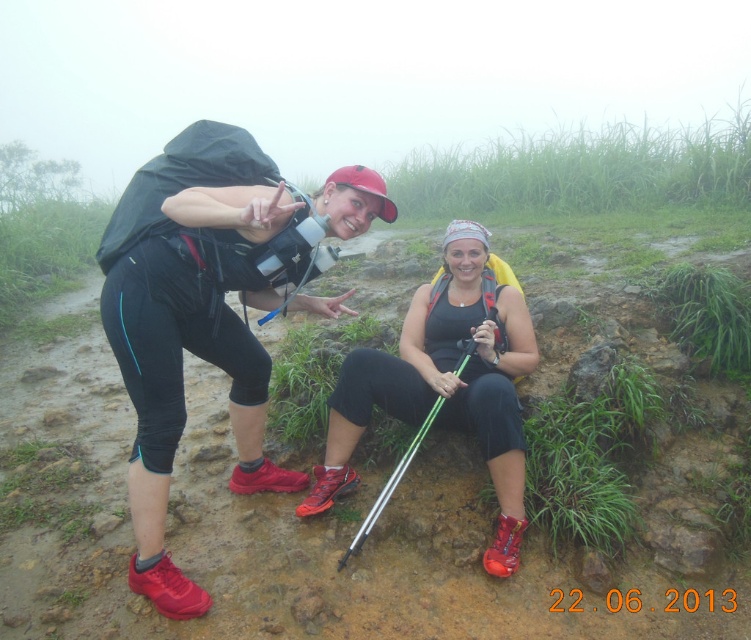
Question: Which point is closer to the camera?

Choices:
 (A) (490, 376)
 (B) (369, 209)
 (C) (369, 524)

Answer: (A)

Question: Considering the real-world distances, which object is closest to the matte black backpack at left?

Choices:
 (A) matte black tank top at center
 (B) green metallic ski pole at lower center

Answer: (A)

Question: Among these points, which one is farthest from the camera?

Choices:
 (A) (517, 444)
 (B) (484, 445)
 (C) (421, 433)

Answer: (C)

Question: Is matte black backpack at left positioned in front of matte black tank top at center?

Choices:
 (A) yes
 (B) no

Answer: (A)

Question: Can you confirm if matte black backpack at left is positioned below matte black tank top at center?

Choices:
 (A) yes
 (B) no

Answer: (A)

Question: Is matte black backpack at left further to the viewer compared to matte black tank top at center?

Choices:
 (A) no
 (B) yes

Answer: (A)